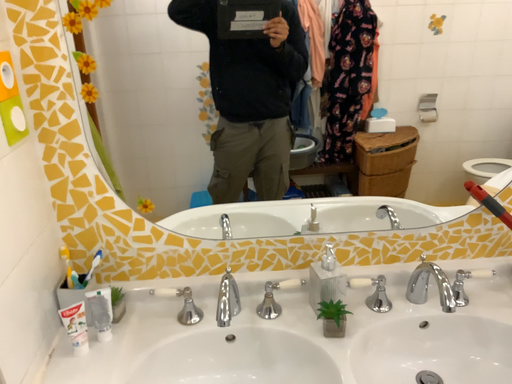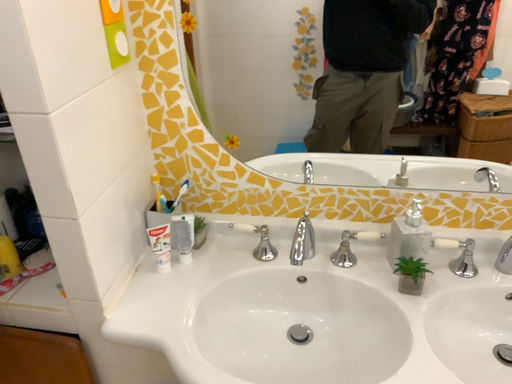
Question: How did the camera likely rotate when shooting the video?

Choices:
 (A) rotated right
 (B) rotated left

Answer: (B)